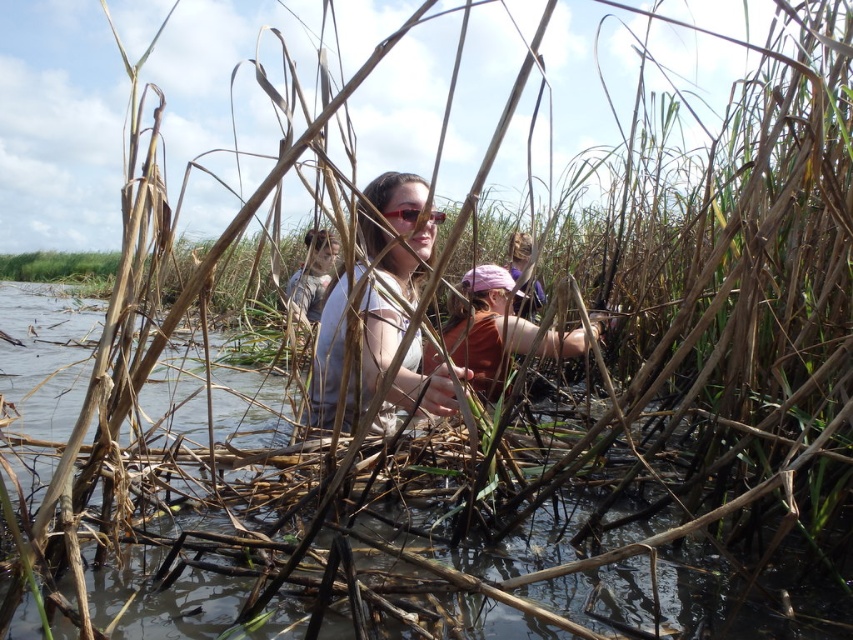
You are navigating through the marshy area and see two points marked in the image. Which point is closer to you, point (392, 182) or point (415, 209)?

Point (415, 209) is closer to you because point (392, 182) is behind it.

You are standing at the edge of the marsh and see a person wearing a matte white shirt at center and sunglasses at center. Which item is closer to your left side?

The matte white shirt at center is to the left of sunglasses at center, so the matte white shirt at center is closer to your left side.

You are a photographer trying to capture a clear shot of the matte orange shirt at center and the sunglasses at center. Since the tall reeds are blocking your view, which object would you need to adjust your camera angle to see better?

The sunglasses at center is shorter than the matte orange shirt at center, so you would need to adjust your camera angle to see the sunglasses at center better as it might be partially hidden by the reeds.